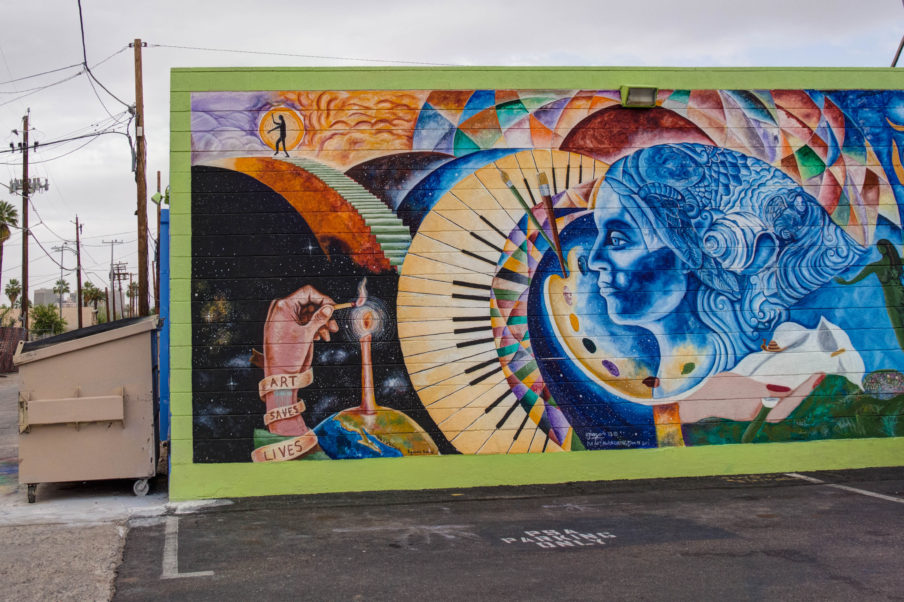
You are a GUI agent. You are given a task and a screenshot of the screen. Output one action in this format:
    pyautogui.click(x=<x>, y=<y>)
    Task: Click on the mural
    
    Given the screenshot: What is the action you would take?
    pyautogui.click(x=257, y=306)